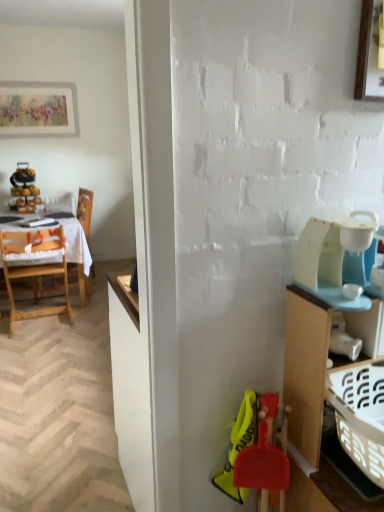
At what (x,y) coordinates should I click in order to perform the action: click on blank space above matte white picture frame at upper left, which ranks as the first picture frame in top-to-bottom order (from a real-world perspective). Please return your answer as a coordinate pair (x, y). Image resolution: width=384 pixels, height=512 pixels. Looking at the image, I should click on (36, 82).